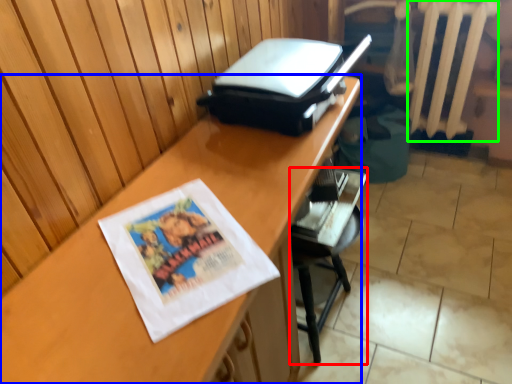
Question: Considering the real-world distances, which object is closest to furniture (highlighted by a red box)? desk (highlighted by a blue box) or radiator (highlighted by a green box).

Choices:
 (A) desk
 (B) radiator

Answer: (A)